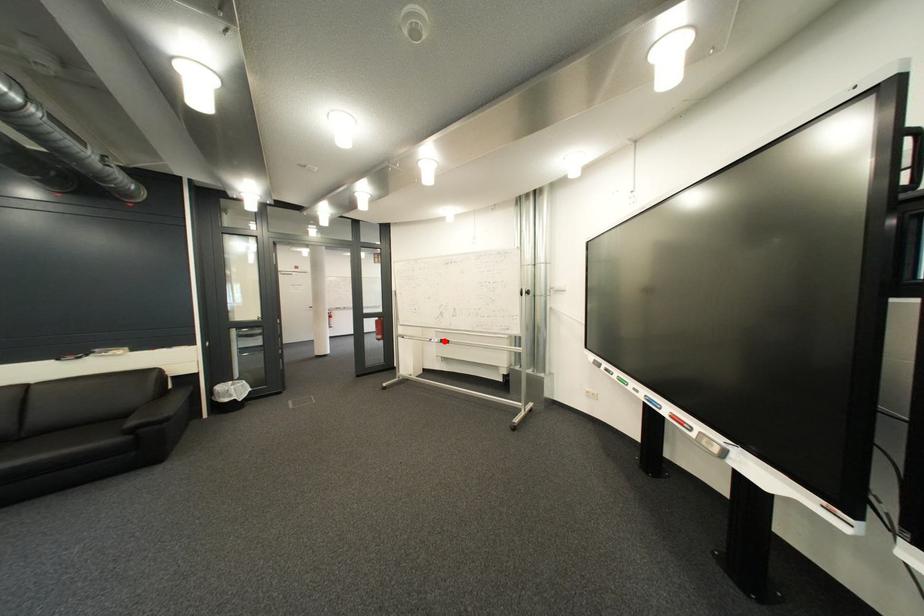
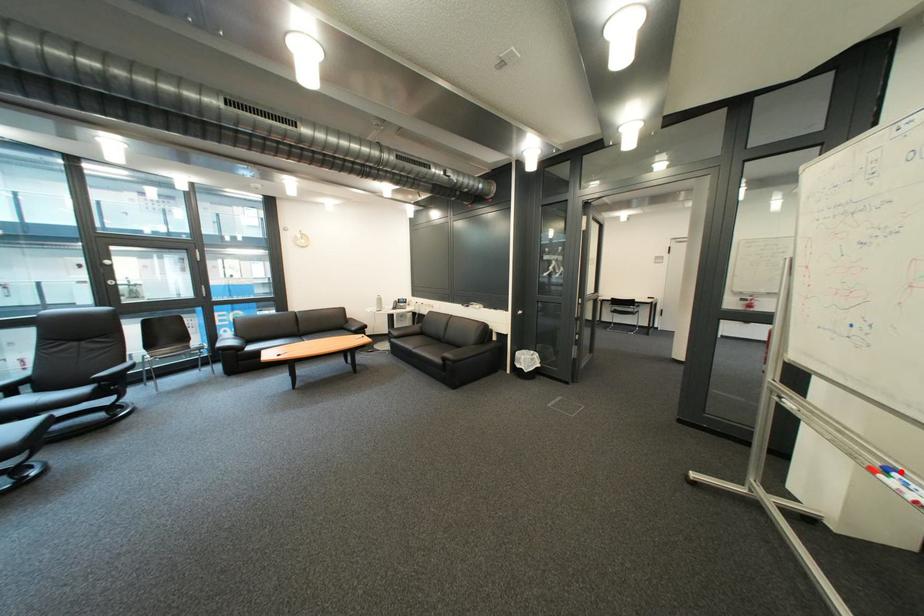
From the picture: I am providing you with two images of the same scene from different viewpoints. A red point is marked on the first image and another point is marked on the second image. Is the marked point in image1 the same physical position as the marked point in image2?

Yes